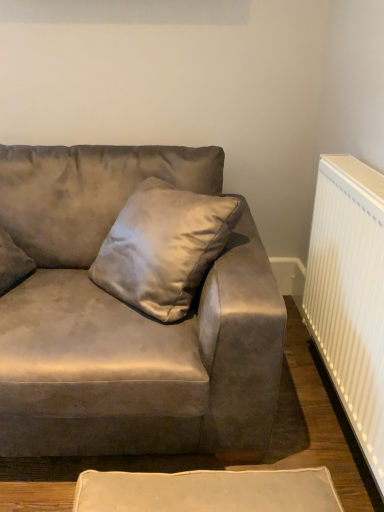
Question: In terms of width, does suede gray couch at center look wider or thinner when compared to satin gray pillow at center?

Choices:
 (A) wide
 (B) thin

Answer: (A)

Question: Is suede gray couch at center taller or shorter than satin gray pillow at center?

Choices:
 (A) tall
 (B) short

Answer: (A)

Question: Which object is positioned closest to the white ribbed radiator at right?

Choices:
 (A) satin gray pillow at center
 (B) suede gray couch at center

Answer: (B)

Question: Based on their relative distances, which object is nearer to the white ribbed radiator at right?

Choices:
 (A) satin gray pillow at center
 (B) suede gray couch at center

Answer: (B)